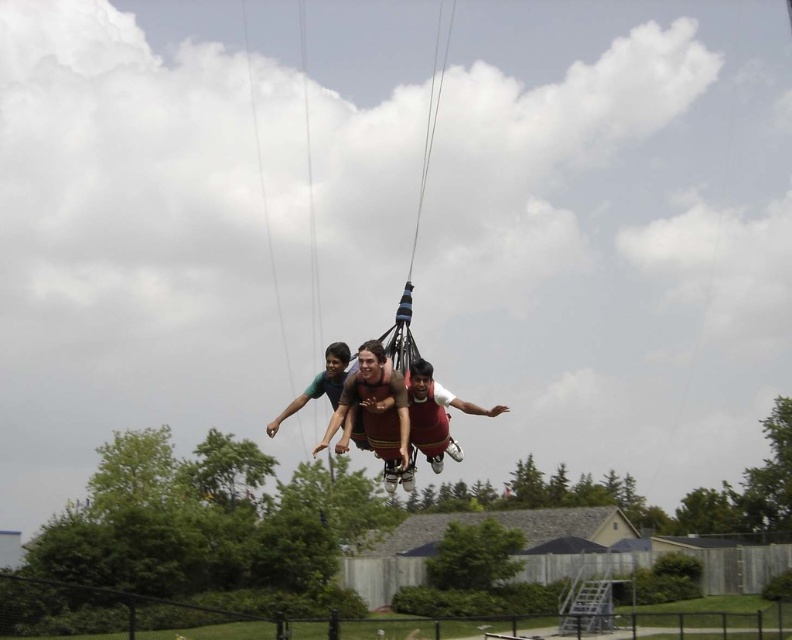
Does brown fabric parachute at center have a lesser height compared to brown fabric swing at center?

Yes.

Between brown fabric parachute at center and brown fabric swing at center, which one is positioned lower?

Positioned lower is brown fabric parachute at center.

Image resolution: width=792 pixels, height=640 pixels. What do you see at coordinates (374, 412) in the screenshot? I see `brown fabric parachute at center` at bounding box center [374, 412].

Where is `brown fabric parachute at center`? The image size is (792, 640). brown fabric parachute at center is located at coordinates (374, 412).

Based on the photo, can you confirm if reddish-brown fabric parachute at center is positioned to the left of brown fabric swing at center?

Incorrect, reddish-brown fabric parachute at center is not on the left side of brown fabric swing at center.

Does reddish-brown fabric parachute at center appear under brown fabric swing at center?

Indeed, reddish-brown fabric parachute at center is positioned under brown fabric swing at center.

Is point (421, 401) farther from camera compared to point (398, 314)?

No.

The image size is (792, 640). I want to click on reddish-brown fabric parachute at center, so click(x=436, y=413).

Is point (396, 397) positioned after point (438, 458)?

That is False.

The width and height of the screenshot is (792, 640). In order to click on brown fabric parachute at center in this screenshot , I will do [x=374, y=412].